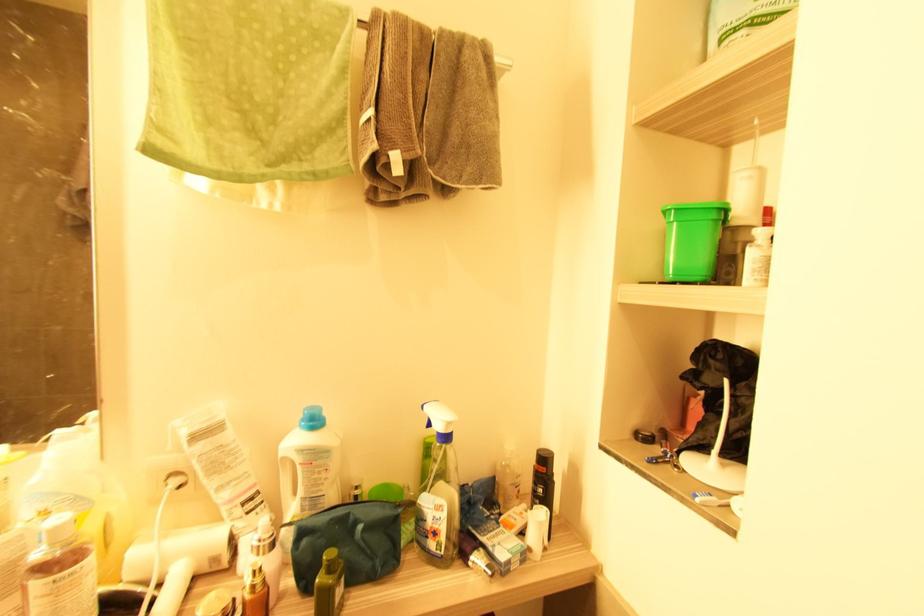
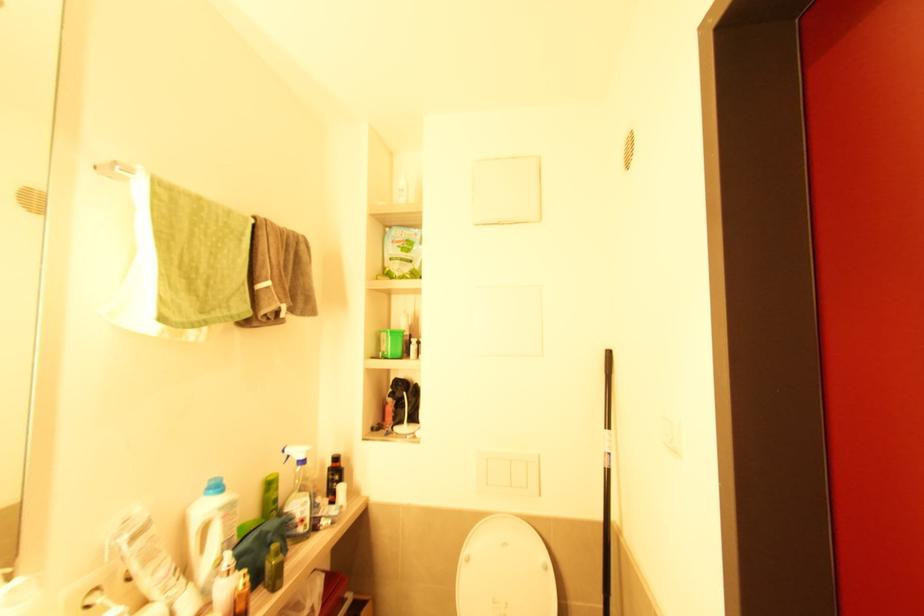
The point at (447, 438) is marked in the first image. Where is the corresponding point in the second image?

(305, 462)